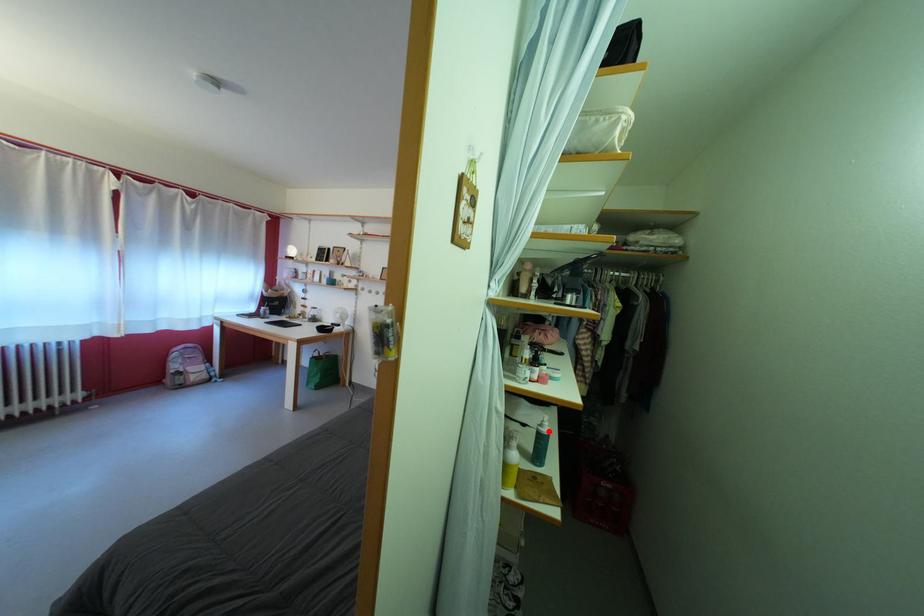
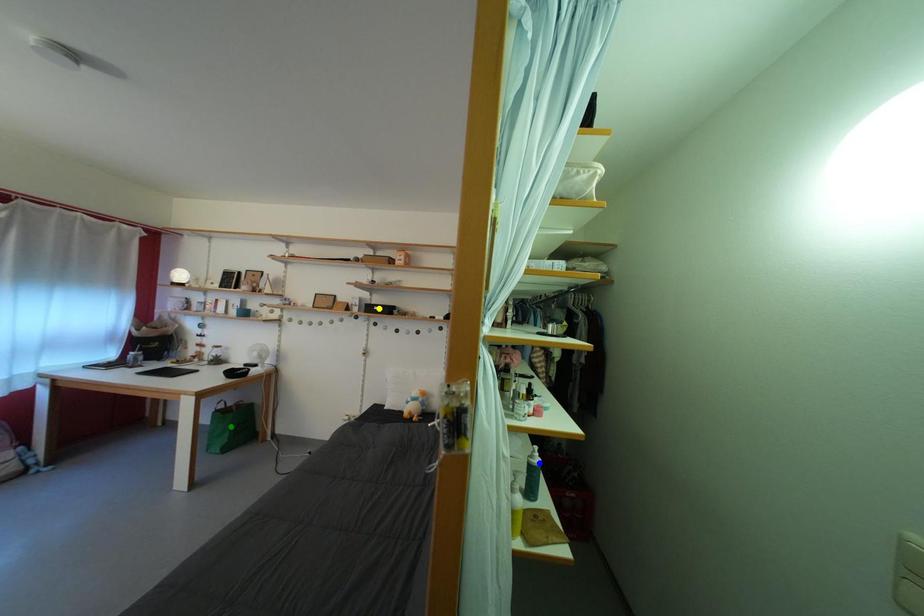
Question: I am providing you with two images of the same scene from different viewpoints. A red point is marked on the first image. You are given multiple points on the second image. Which spot in image 2 lines up with the point in image 1?

Choices:
 (A) green point
 (B) yellow point
 (C) blue point

Answer: (C)